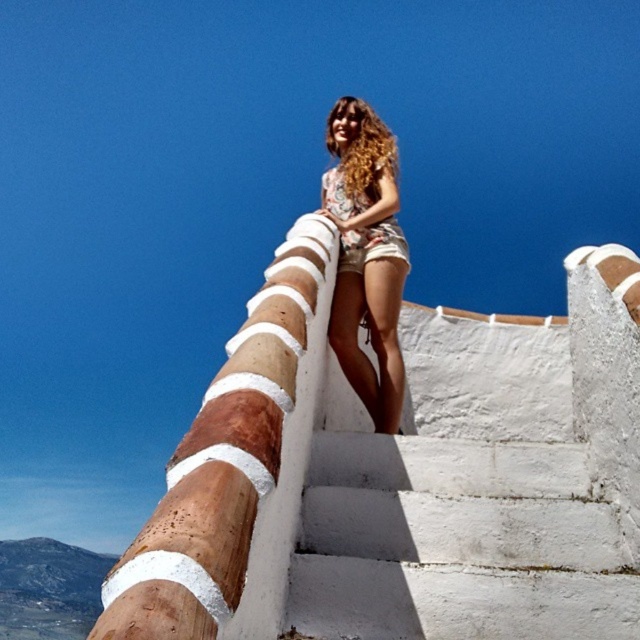
Is point (225, 464) less distant than point (353, 378)?

Yes, it is in front of point (353, 378).

Is brown wood pole at upper center wider than floral fabric shorts at center?

Indeed, brown wood pole at upper center has a greater width compared to floral fabric shorts at center.

Is point (298, 308) less distant than point (339, 129)?

Yes, point (298, 308) is closer to viewer.

Identify the location of brown wood pole at upper center. (224, 461).

Describe the element at coordinates (456, 544) in the screenshot. This screenshot has height=640, width=640. I see `white painted concrete stairs at center` at that location.

Is white painted concrete stairs at center wider than curly blonde hair at upper center?

Yes, white painted concrete stairs at center is wider than curly blonde hair at upper center.

Is point (404, 483) positioned in front of point (369, 109)?

Yes, it is.

Where is `white painted concrete stairs at center`? white painted concrete stairs at center is located at coordinates (456, 544).

Which is in front, point (392, 369) or point (392, 144)?

Point (392, 369) is in front.

Who is more distant from viewer, (380, 179) or (362, 180)?

The point (380, 179) is more distant.

At what (x,y) coordinates should I click in order to perform the action: click on floral fabric shorts at center. Please return your answer as a coordinate pair (x, y). The image size is (640, 640). Looking at the image, I should click on (365, 256).